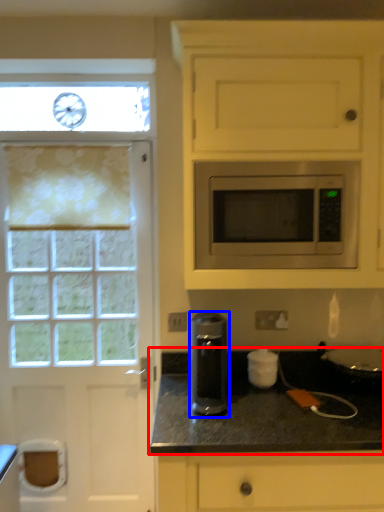
Question: Which of the following is the closest to the observer, countertop (highlighted by a red box) or kitchen appliance (highlighted by a blue box)?

Choices:
 (A) countertop
 (B) kitchen appliance

Answer: (A)